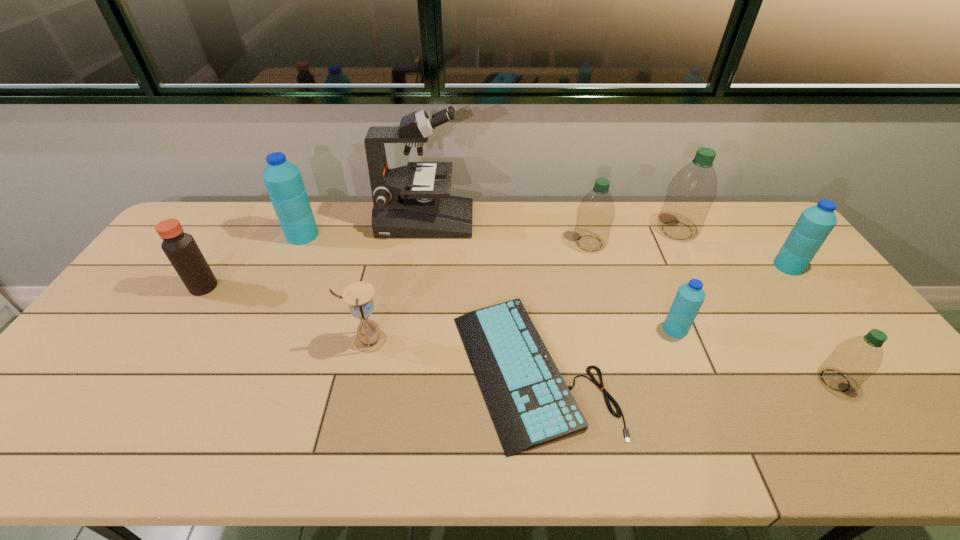
Find the location of a particular element. blank region between the hourglass and the tallest object is located at coordinates (396, 281).

The width and height of the screenshot is (960, 540). I want to click on free space between the white hourglass and the third object from right to left, so click(x=522, y=286).

Identify the location of free point between the fourth water bottle from left to right and the brown vinegar. (441, 259).

At what (x,y) coordinates should I click in order to perform the action: click on unoccupied area between the third object from right to left and the leftmost object. Please return your answer as a coordinate pair (x, y). Image resolution: width=960 pixels, height=540 pixels. Looking at the image, I should click on (x=441, y=259).

Where is `free space between the biggest blue water bottle and the nearest water bottle`? free space between the biggest blue water bottle and the nearest water bottle is located at coordinates (x=569, y=308).

Find the location of a particular element. This screenshot has height=540, width=960. object that is the third nearest to the shortest object is located at coordinates (596, 212).

Select which object is the fourth closest to the microscope. Please provide its 2D coordinates. Your answer should be formatted as a tuple, i.e. [(x, y)], where the tuple contains the x and y coordinates of a point satisfying the conditions above.

[(370, 339)]

Identify which water bottle is the fifth nearest to the leftmost water bottle. Please provide its 2D coordinates. Your answer should be formatted as a tuple, i.e. [(x, y)], where the tuple contains the x and y coordinates of a point satisfying the conditions above.

[(815, 223)]

The width and height of the screenshot is (960, 540). Find the location of `water bottle that is the second nearest to the computer keyboard`. water bottle that is the second nearest to the computer keyboard is located at coordinates (596, 212).

Where is `green water bottle that is the second closest to the second green water bottle from left to right`? green water bottle that is the second closest to the second green water bottle from left to right is located at coordinates (853, 361).